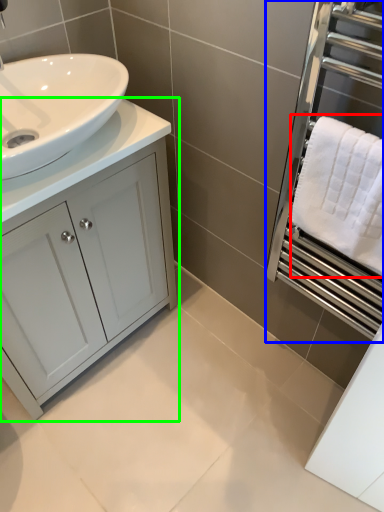
Question: Which object is the closest to the bath towel (highlighted by a red box)? Choose among these: screen door (highlighted by a blue box) or bathroom cabinet (highlighted by a green box).

Choices:
 (A) screen door
 (B) bathroom cabinet

Answer: (A)